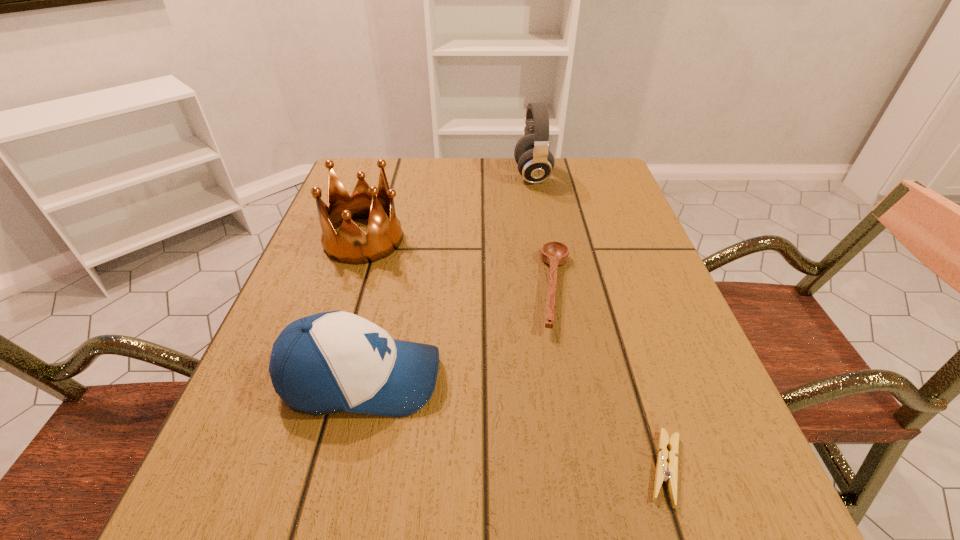
At what (x,y) coordinates should I click in order to perform the action: click on headset. Please return your answer as a coordinate pair (x, y). Image resolution: width=960 pixels, height=540 pixels. Looking at the image, I should click on (535, 162).

Locate an element on the screen. the second tallest object is located at coordinates (351, 245).

Image resolution: width=960 pixels, height=540 pixels. I want to click on the fourth farthest object, so click(x=331, y=362).

Locate an element on the screen. This screenshot has width=960, height=540. the third shortest object is located at coordinates (331, 362).

At what (x,y) coordinates should I click in order to perform the action: click on the second shortest object. Please return your answer as a coordinate pair (x, y). Image resolution: width=960 pixels, height=540 pixels. Looking at the image, I should click on (553, 253).

Find the location of `the rightmost object`. the rightmost object is located at coordinates (x=668, y=472).

Identify the location of the shortest object. point(668,472).

This screenshot has height=540, width=960. Find the location of `vacant space located 0.290m on the ear cups of the headset`. vacant space located 0.290m on the ear cups of the headset is located at coordinates (406, 176).

Identify the location of free space located 0.060m on the ear cups of the headset. (492, 176).

This screenshot has height=540, width=960. Identify the location of free spot located 0.380m on the ear cups of the headset. (373, 176).